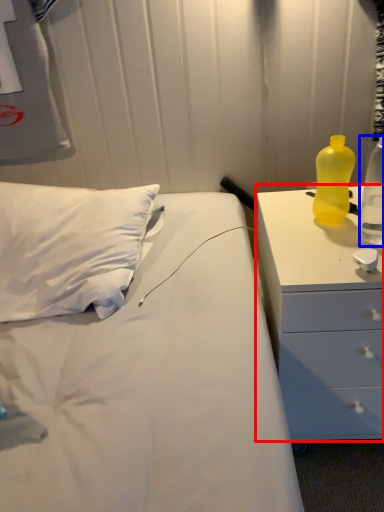
Question: Which point is closer to the camera, chest of drawers (highlighted by a red box) or bottle (highlighted by a blue box)?

Choices:
 (A) chest of drawers
 (B) bottle

Answer: (A)